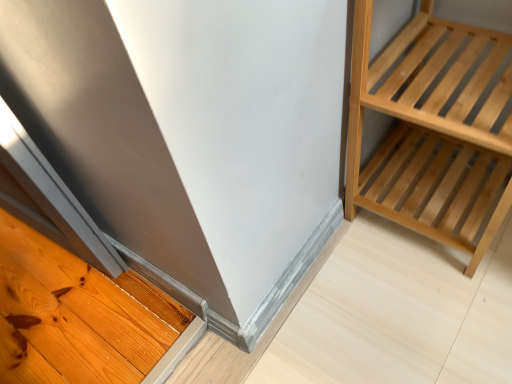
Image resolution: width=512 pixels, height=384 pixels. What do you see at coordinates (432, 131) in the screenshot?
I see `natural wood shelf at right` at bounding box center [432, 131].

Identify the location of natural wood shelf at right. (432, 131).

The height and width of the screenshot is (384, 512). I want to click on natural wood shelf at right, so click(432, 131).